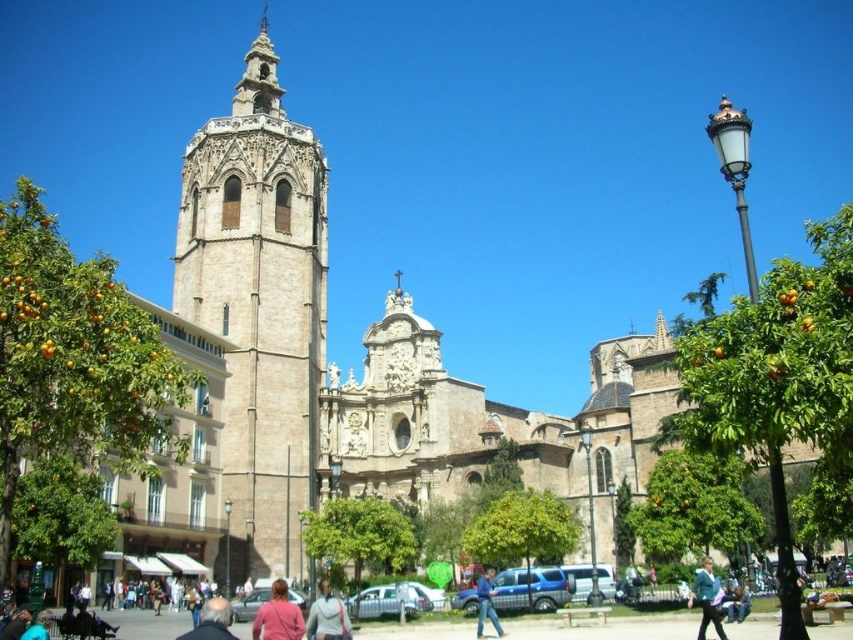
Is pink fabric at center to the left of blue denim jacket at lower right from the viewer's perspective?

Yes, pink fabric at center is to the left of blue denim jacket at lower right.

You are a GUI agent. You are given a task and a screenshot of the screen. Output one action in this format:
    pyautogui.click(x=<x>, y=<y>)
    Task: Click on the pink fabric at center
    Image resolution: width=853 pixels, height=640 pixels.
    Given the screenshot: What is the action you would take?
    pyautogui.click(x=277, y=616)

Does light gray sweater at center have a greater width compared to dark blue jacket at center?

Incorrect, light gray sweater at center's width does not surpass dark blue jacket at center's.

Does light gray sweater at center appear on the right side of dark blue jacket at center?

Indeed, light gray sweater at center is positioned on the right side of dark blue jacket at center.

Who is more distant from viewer, (x=323, y=624) or (x=187, y=637)?

Point (x=323, y=624)

Where is `light gray sweater at center`? light gray sweater at center is located at coordinates (328, 616).

Who is positioned more to the right, orange matte tree at left or pink fabric at center?

Result: pink fabric at center is more to the right.

Is the position of orange matte tree at left more distant than that of pink fabric at center?

No, it is not.

Does point (18, 522) come in front of point (283, 593)?

No, (18, 522) is behind (283, 593).

This screenshot has height=640, width=853. I want to click on orange matte tree at left, so click(73, 390).